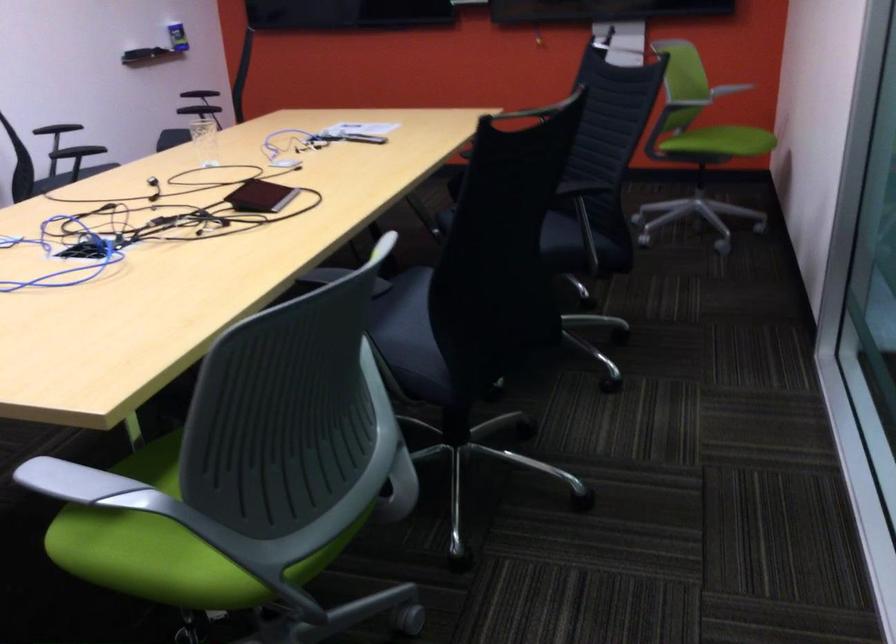
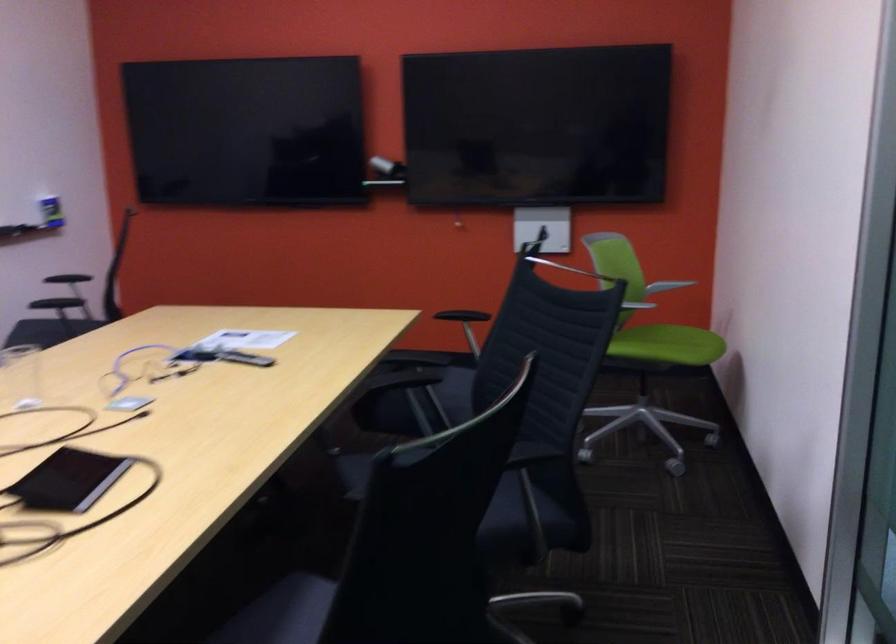
Find the pixel in the second image that matches [364,136] in the first image.

(244, 357)